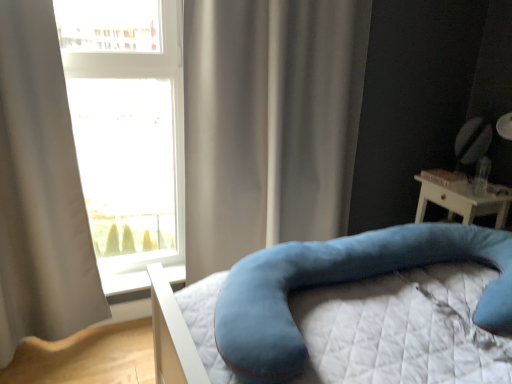
Question: Does light gray fabric curtain at left, which appears as the first curtain when viewed from the left, appear on the right side of satin beige curtain at center, the second curtain viewed from the left?

Choices:
 (A) yes
 (B) no

Answer: (B)

Question: Does light gray fabric curtain at left, which appears as the first curtain when viewed from the left, appear on the left side of satin beige curtain at center, the second curtain viewed from the left?

Choices:
 (A) yes
 (B) no

Answer: (A)

Question: Does light gray fabric curtain at left, which appears as the first curtain when viewed from the left, have a lesser width compared to satin beige curtain at center, the second curtain viewed from the left?

Choices:
 (A) yes
 (B) no

Answer: (A)

Question: Is light gray fabric curtain at left, which appears as the first curtain when viewed from the left, completely or partially outside of satin beige curtain at center, the second curtain viewed from the left?

Choices:
 (A) no
 (B) yes

Answer: (B)

Question: Is light gray fabric curtain at left, which appears as the first curtain when viewed from the left, positioned behind satin beige curtain at center, the second curtain viewed from the left?

Choices:
 (A) no
 (B) yes

Answer: (A)

Question: Does light gray fabric curtain at left, which ranks as the 2th curtain in right-to-left order, have a lesser height compared to satin beige curtain at center, which ranks as the first curtain in right-to-left order?

Choices:
 (A) no
 (B) yes

Answer: (A)

Question: Would you say transparent glass window at upper left is part of white plastic window sill at lower left's contents?

Choices:
 (A) yes
 (B) no

Answer: (B)

Question: Considering the relative sizes of white plastic window sill at lower left and transparent glass window at upper left in the image provided, is white plastic window sill at lower left thinner than transparent glass window at upper left?

Choices:
 (A) yes
 (B) no

Answer: (B)

Question: Is the surface of white plastic window sill at lower left in direct contact with transparent glass window at upper left?

Choices:
 (A) yes
 (B) no

Answer: (B)

Question: Can you confirm if white plastic window sill at lower left is wider than transparent glass window at upper left?

Choices:
 (A) no
 (B) yes

Answer: (B)

Question: From a real-world perspective, is white plastic window sill at lower left physically below transparent glass window at upper left?

Choices:
 (A) yes
 (B) no

Answer: (A)

Question: Does white plastic window sill at lower left have a larger size compared to transparent glass window at upper left?

Choices:
 (A) no
 (B) yes

Answer: (A)

Question: Is satin beige curtain at center, which ranks as the first curtain in right-to-left order, closer to the viewer compared to white plastic window sill at lower left?

Choices:
 (A) yes
 (B) no

Answer: (A)